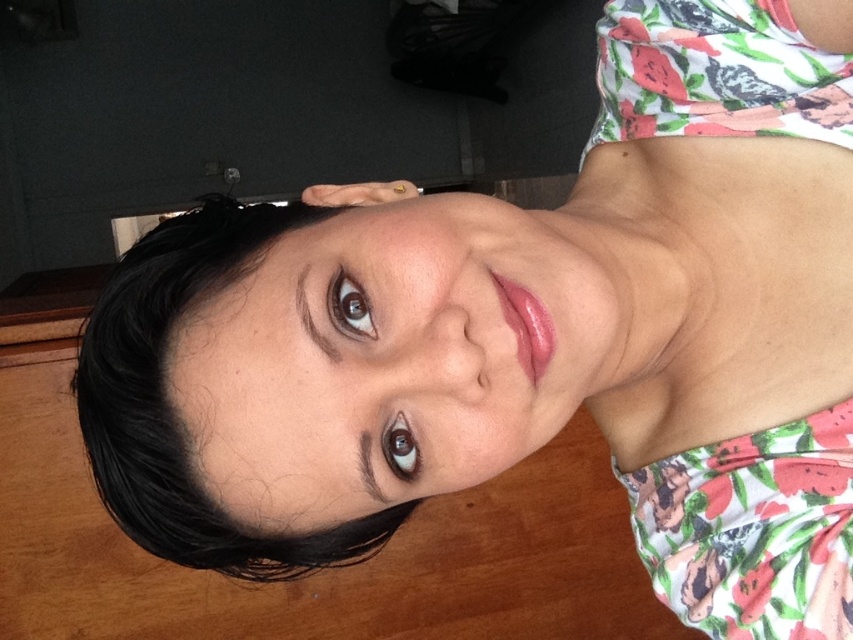
Question: Which point is closer to the camera?

Choices:
 (A) floral fabric dress at center
 (B) black smooth hair at upper left

Answer: (B)

Question: In this image, where is black smooth hair at upper left located relative to floral fabric dress at center?

Choices:
 (A) left
 (B) right

Answer: (A)

Question: Is black smooth hair at upper left below floral fabric bikini top at upper right?

Choices:
 (A) yes
 (B) no

Answer: (A)

Question: Among these objects, which one is farthest from the camera?

Choices:
 (A) floral fabric bikini top at upper right
 (B) floral fabric dress at center
 (C) black smooth hair at upper left

Answer: (A)

Question: Which of the following is the farthest from the observer?

Choices:
 (A) (192, 474)
 (B) (665, 32)

Answer: (B)

Question: Is floral fabric dress at center to the left of floral fabric bikini top at upper right from the viewer's perspective?

Choices:
 (A) no
 (B) yes

Answer: (A)